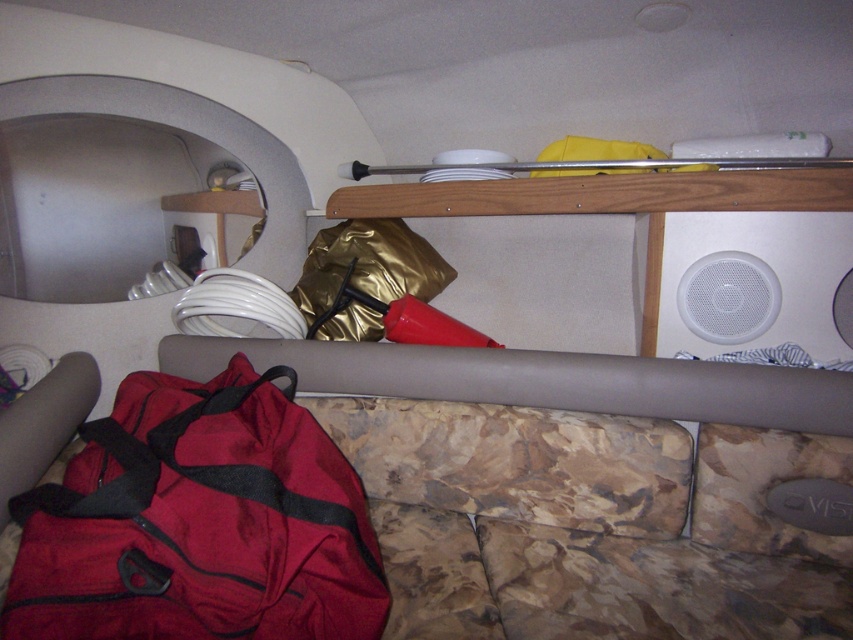
Looking at this image, does red fabric bag at lower left have a lesser height compared to gold metallic bag at center?

Incorrect, red fabric bag at lower left's height does not fall short of gold metallic bag at center's.

What do you see at coordinates (198, 522) in the screenshot? The image size is (853, 640). I see `red fabric bag at lower left` at bounding box center [198, 522].

Which is in front, point (279, 516) or point (397, 260)?

Point (279, 516) is more forward.

Identify the location of red fabric bag at lower left. The height and width of the screenshot is (640, 853). (198, 522).

Can you confirm if red fabric duffel at lower left is shorter than gold metallic bag at center?

Incorrect, red fabric duffel at lower left's height does not fall short of gold metallic bag at center's.

Does red fabric duffel at lower left have a smaller size compared to gold metallic bag at center?

No.

Measure the distance between point (717, 536) and camera.

A distance of 3.89 feet exists between point (717, 536) and camera.

You are a GUI agent. You are given a task and a screenshot of the screen. Output one action in this format:
    pyautogui.click(x=<x>, y=<y>)
    Task: Click on the red fabric duffel at lower left
    
    Given the screenshot: What is the action you would take?
    pyautogui.click(x=589, y=524)

Is point (496, 618) positioned behind point (338, 189)?

That is False.

What do you see at coordinates (589, 524) in the screenshot?
I see `red fabric duffel at lower left` at bounding box center [589, 524].

Does point (798, 593) come closer to viewer compared to point (331, 200)?

Yes.

This screenshot has height=640, width=853. Find the location of `red fabric duffel at lower left`. red fabric duffel at lower left is located at coordinates (589, 524).